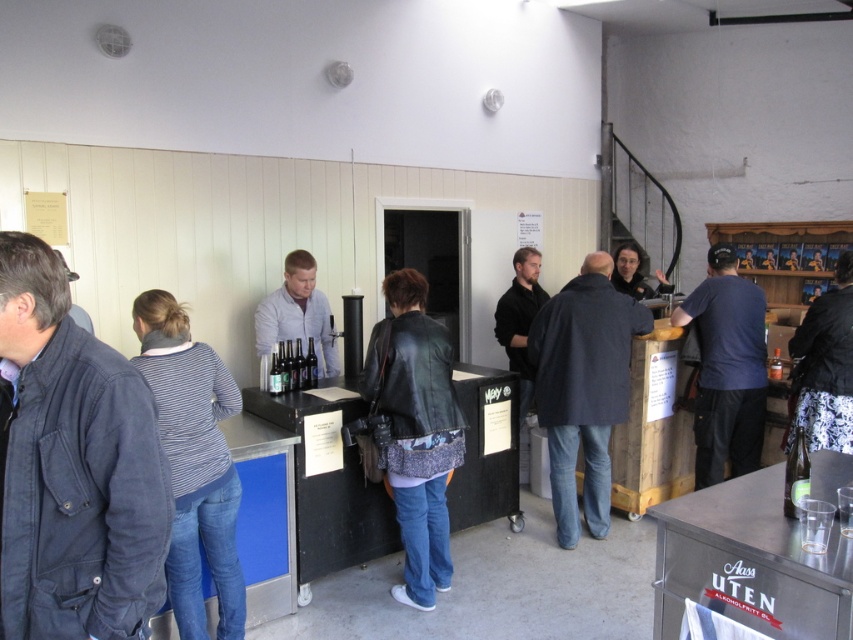
You are a customer at the bar and want to grab both the striped cotton shirt at center and the black leather jacket at right. Which one is taller so you can reach it easily?

The striped cotton shirt at center is taller than the black leather jacket at right, so you can reach it easily.